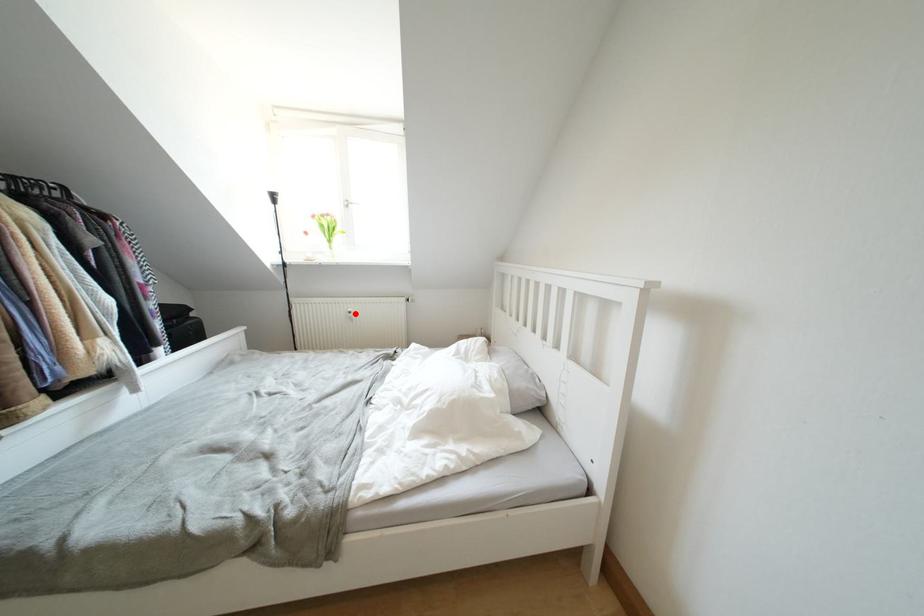
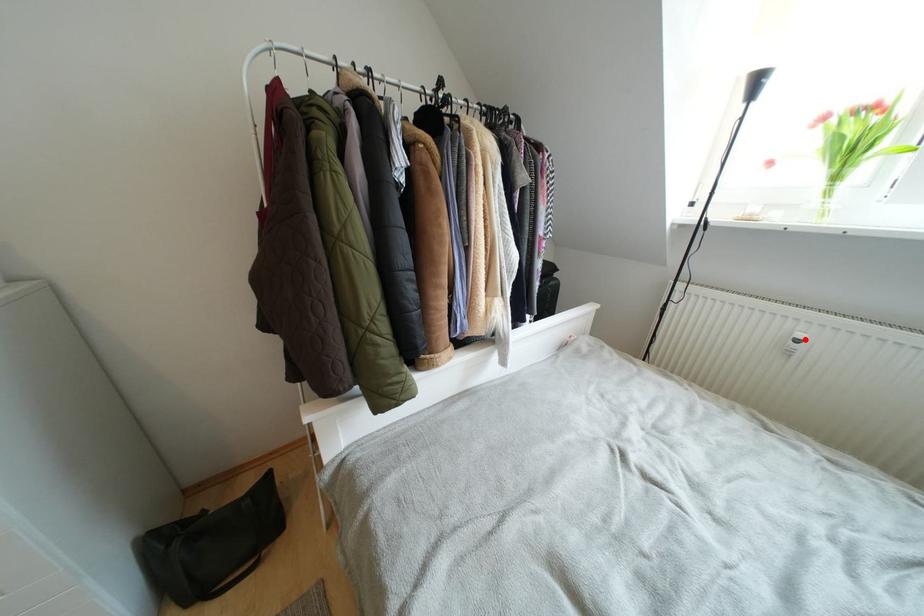
I am providing you with two images of the same scene from different viewpoints. A red point is marked on the first image and another point is marked on the second image. Do the highlighted points in image1 and image2 indicate the same real-world spot?

Yes